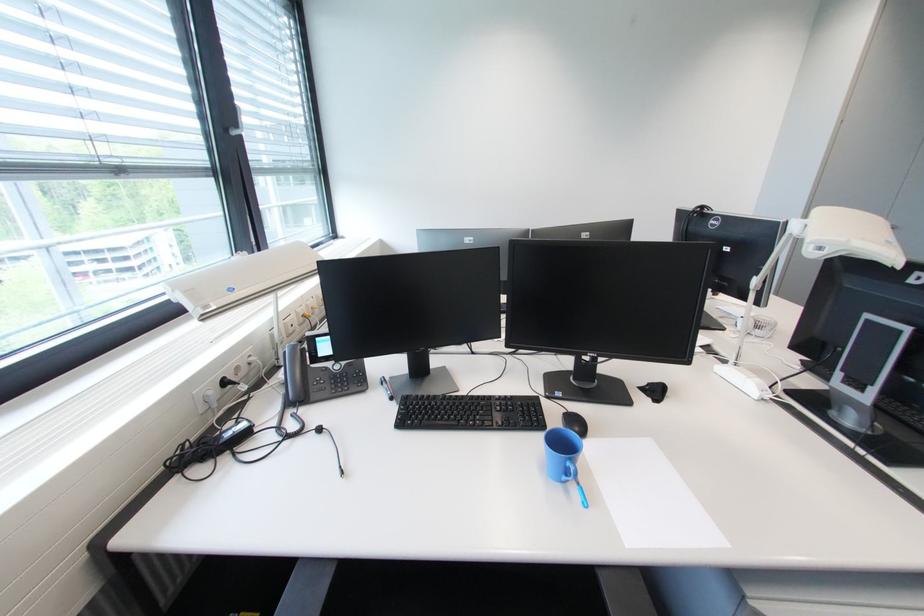
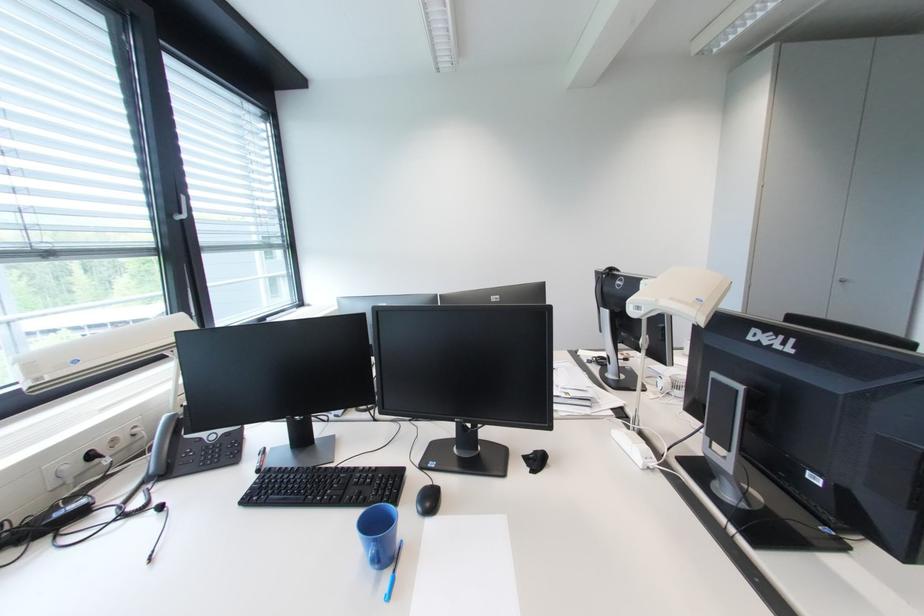
Question: Which direction would the cameraman need to move to produce the second image? Reply with the corresponding letter.

Choices:
 (A) Left
 (B) Right
 (C) Forward
 (D) Backward

Answer: (B)